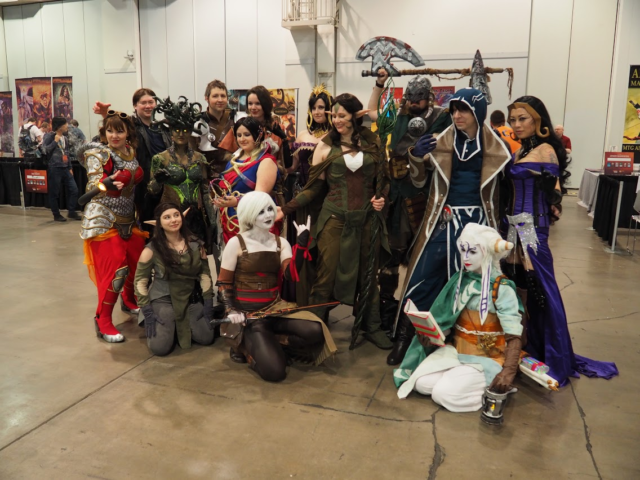
Locate an element on the screen. light fixture is located at coordinates (132, 56).